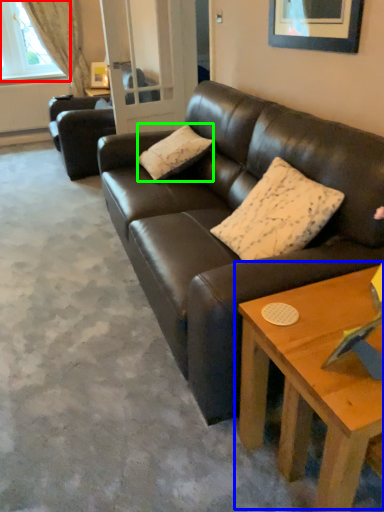
Question: Based on their relative distances, which object is nearer to window (highlighted by a red box)? Choose from coffee table (highlighted by a blue box) and pillow (highlighted by a green box).

Choices:
 (A) coffee table
 (B) pillow

Answer: (B)